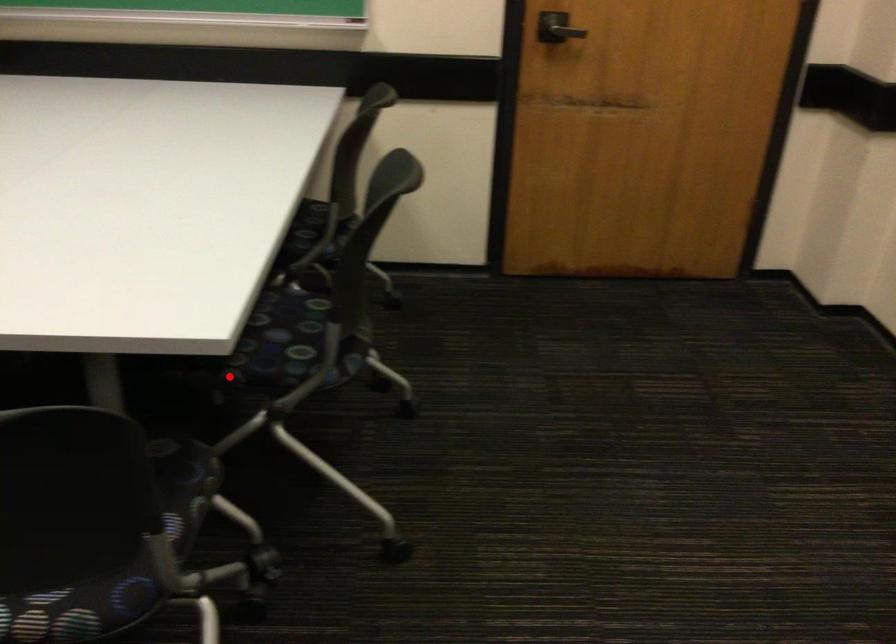
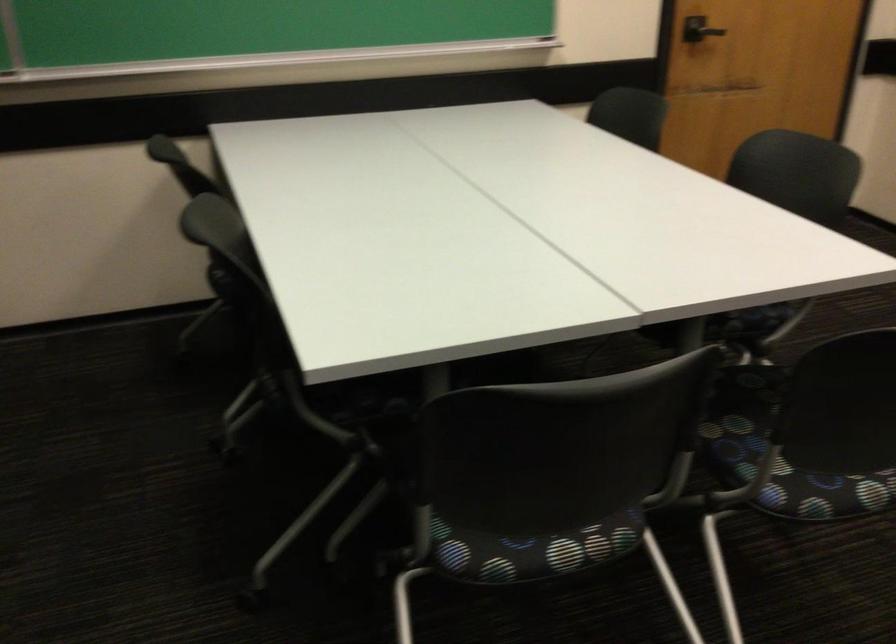
Question: A red point is marked in image1. In image2, is the corresponding 3D point closer to the camera or farther? Reply with the corresponding letter.

Choices:
 (A) The corresponding 3D point is closer.
 (B) The corresponding 3D point is farther.

Answer: (B)